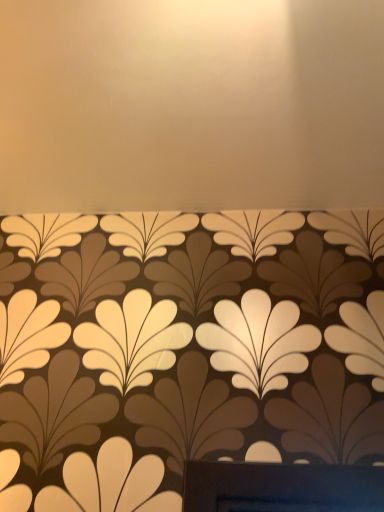
Describe the element at coordinates (191, 105) in the screenshot. The height and width of the screenshot is (512, 384). I see `brown matte wallpaper at lower center` at that location.

Find the location of a particular element. This screenshot has height=512, width=384. brown matte wallpaper at lower center is located at coordinates (191, 105).

Measure the distance between brown matte wallpaper at lower center and camera.

brown matte wallpaper at lower center and camera are 27.39 inches apart.

Identify the location of brown matte wallpaper at lower center. The height and width of the screenshot is (512, 384). (191, 105).